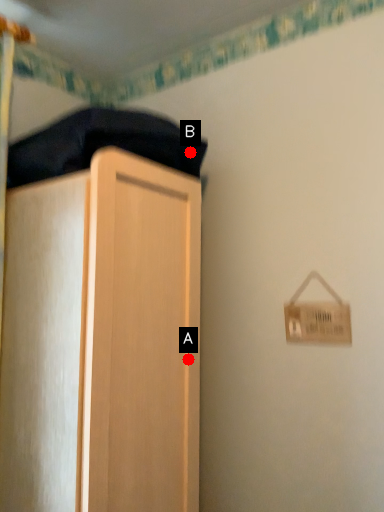
Question: Two points are circled on the image, labeled by A and B beside each circle. Which point is farther to the camera?

Choices:
 (A) A is further
 (B) B is further

Answer: (B)